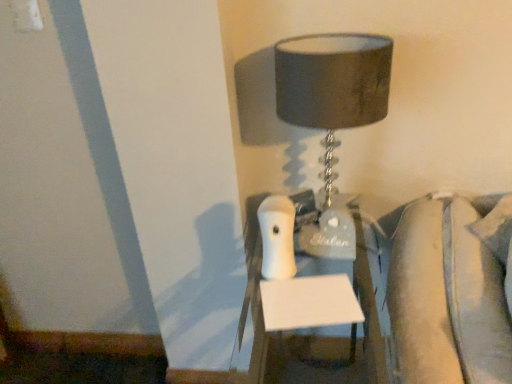
Question: Does white glossy nightstand at center have a lesser width compared to matte gray lampshade at upper center?

Choices:
 (A) no
 (B) yes

Answer: (A)

Question: From the image's perspective, is white glossy nightstand at center over matte gray lampshade at upper center?

Choices:
 (A) yes
 (B) no

Answer: (B)

Question: From the image's perspective, would you say white glossy nightstand at center is shown under matte gray lampshade at upper center?

Choices:
 (A) no
 (B) yes

Answer: (B)

Question: From a real-world perspective, is white glossy nightstand at center located beneath matte gray lampshade at upper center?

Choices:
 (A) yes
 (B) no

Answer: (A)

Question: From a real-world perspective, is white glossy nightstand at center on matte gray lampshade at upper center?

Choices:
 (A) yes
 (B) no

Answer: (B)

Question: Is the position of white glossy nightstand at center more distant than that of matte gray lampshade at upper center?

Choices:
 (A) no
 (B) yes

Answer: (A)

Question: Could you tell me if matte gray lampshade at upper center is turned towards white glossy nightstand at center?

Choices:
 (A) yes
 (B) no

Answer: (B)

Question: Is there a large distance between matte gray lampshade at upper center and white glossy nightstand at center?

Choices:
 (A) no
 (B) yes

Answer: (A)

Question: Is matte gray lampshade at upper center facing away from white glossy nightstand at center?

Choices:
 (A) yes
 (B) no

Answer: (B)

Question: From a real-world perspective, is matte gray lampshade at upper center over white glossy nightstand at center?

Choices:
 (A) no
 (B) yes

Answer: (B)

Question: Considering the relative sizes of matte gray lampshade at upper center and white glossy nightstand at center in the image provided, is matte gray lampshade at upper center bigger than white glossy nightstand at center?

Choices:
 (A) yes
 (B) no

Answer: (B)

Question: Can you confirm if matte gray lampshade at upper center is positioned to the left of white glossy nightstand at center?

Choices:
 (A) yes
 (B) no

Answer: (A)

Question: From their relative heights in the image, would you say matte gray lampshade at upper center is taller or shorter than white glossy nightstand at center?

Choices:
 (A) short
 (B) tall

Answer: (A)